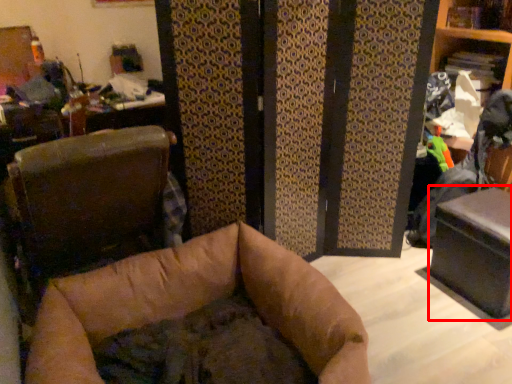
Question: From the image, what is the correct spatial relationship of table (annotated by the red box) in relation to furniture?

Choices:
 (A) left
 (B) right

Answer: (B)